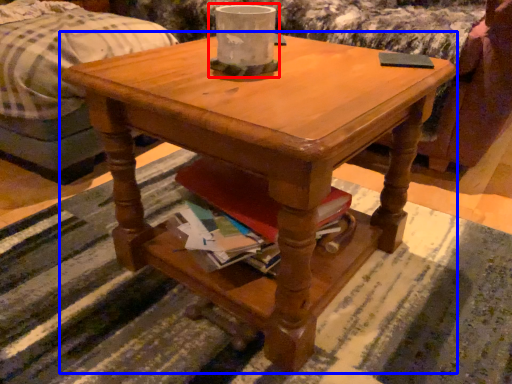
Question: Which object is further to the camera taking this photo, candle holder (highlighted by a red box) or coffee table (highlighted by a blue box)?

Choices:
 (A) candle holder
 (B) coffee table

Answer: (A)